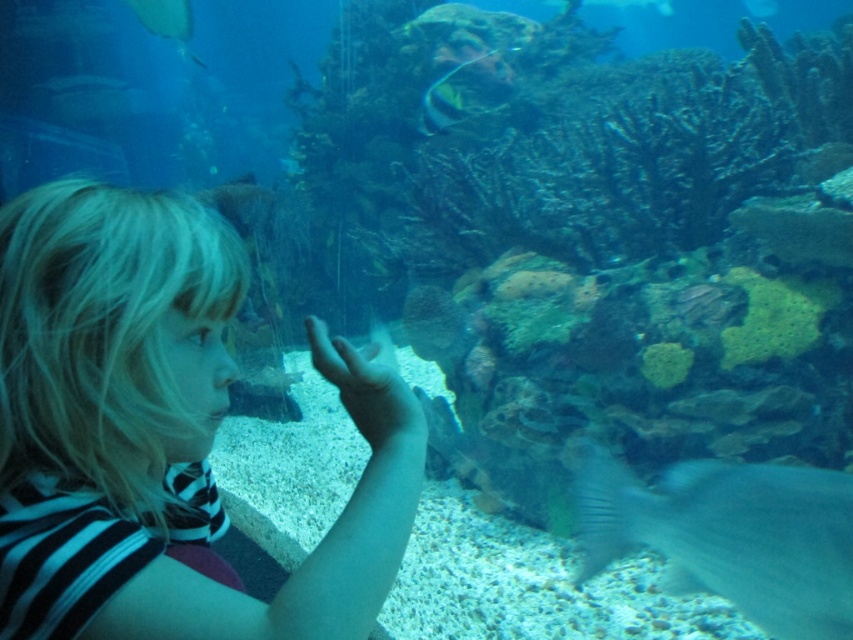
Question: Considering the relative positions of shiny silver fish at upper center and translucent glass fish at upper right in the image provided, where is shiny silver fish at upper center located with respect to translucent glass fish at upper right?

Choices:
 (A) left
 (B) right

Answer: (A)

Question: Which point is closer to the camera taking this photo?

Choices:
 (A) (769, 10)
 (B) (96, 90)
 (C) (793, 483)
 (D) (178, 29)

Answer: (C)

Question: Can you confirm if blonde hair at left is positioned to the right of shiny silver fish at upper center?

Choices:
 (A) yes
 (B) no

Answer: (B)

Question: Can you confirm if blonde hair at left is thinner than shiny silver fish at upper center?

Choices:
 (A) yes
 (B) no

Answer: (A)

Question: Among these points, which one is farthest from the camera?

Choices:
 (A) (109, 292)
 (B) (173, 29)
 (C) (763, 3)

Answer: (C)

Question: Estimate the real-world distances between objects in this image. Which object is farther from the shiny silver fish at upper left?

Choices:
 (A) translucent glass fish at upper right
 (B) translucent glass fish at upper left

Answer: (A)